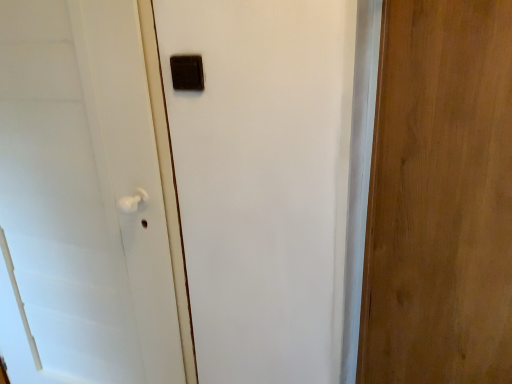
The height and width of the screenshot is (384, 512). Identify the location of matte brown switch at upper center. (187, 72).

From the image's perspective, between white matte door handle at left, the first door viewed from the left, and wooden door at right, the 2th door when ordered from left to right, which one is located above?

From the image's view, wooden door at right, the 2th door when ordered from left to right, is above.

Which of these two, white matte door handle at left, the first door viewed from the left, or wooden door at right, which is the first door in right-to-left order, stands taller?

white matte door handle at left, the first door viewed from the left, is taller.

Is white matte door handle at left, the second door in the right-to-left sequence, facing towards wooden door at right, the 2th door when ordered from left to right?

No, white matte door handle at left, the second door in the right-to-left sequence, is not aimed at wooden door at right, the 2th door when ordered from left to right.

Between point (414, 18) and point (200, 57), which one is positioned in front?

Point (200, 57)

Is the position of wooden door at right, the 2th door when ordered from left to right, more distant than that of matte brown switch at upper center?

That is False.

Is wooden door at right, the 2th door when ordered from left to right, positioned far away from matte brown switch at upper center?

No.

From the picture: Could matte brown switch at upper center be considered to be inside wooden door at right, which is the first door in right-to-left order?

No, matte brown switch at upper center is not a part of wooden door at right, which is the first door in right-to-left order.

Is matte brown switch at upper center positioned before white matte door handle at left, the second door in the right-to-left sequence?

No, the depth of matte brown switch at upper center is greater than that of white matte door handle at left, the second door in the right-to-left sequence.

Locate an element on the screen. The width and height of the screenshot is (512, 384). door on the left of the matte brown switch at upper center is located at coordinates (81, 200).

Consider the image. Is matte brown switch at upper center in contact with white matte door handle at left, the second door in the right-to-left sequence?

matte brown switch at upper center is not next to white matte door handle at left, the second door in the right-to-left sequence, and they're not touching.

Which of these two, matte brown switch at upper center or white matte door handle at left, the first door viewed from the left, stands shorter?

matte brown switch at upper center.

Is white matte door handle at left, the first door viewed from the left, located within wooden door at right, which is the first door in right-to-left order?

Definitely not — white matte door handle at left, the first door viewed from the left, is not inside wooden door at right, which is the first door in right-to-left order.

Is wooden door at right, which is the first door in right-to-left order, to the right of white matte door handle at left, the second door in the right-to-left sequence, from the viewer's perspective?

Yes.

From the image's perspective, which is below, wooden door at right, which is the first door in right-to-left order, or white matte door handle at left, the first door viewed from the left?

white matte door handle at left, the first door viewed from the left, appears lower in the image.

What's the angular difference between wooden door at right, the 2th door when ordered from left to right, and white matte door handle at left, the second door in the right-to-left sequence,'s facing directions?

1.63 degrees separate the facing orientations of wooden door at right, the 2th door when ordered from left to right, and white matte door handle at left, the second door in the right-to-left sequence.

From a real-world perspective, is white matte door handle at left, the second door in the right-to-left sequence, physically above matte brown switch at upper center?

No, from a real-world perspective, white matte door handle at left, the second door in the right-to-left sequence, is not over matte brown switch at upper center

Considering their positions, is white matte door handle at left, the second door in the right-to-left sequence, located in front of or behind matte brown switch at upper center?

Clearly, white matte door handle at left, the second door in the right-to-left sequence, is in front of matte brown switch at upper center.

What are the coordinates of `door that is the 2nd object located below the matte brown switch at upper center (from the image's perspective)` in the screenshot? It's located at (81, 200).

Is white matte door handle at left, the second door in the right-to-left sequence, positioned with its back to matte brown switch at upper center?

white matte door handle at left, the second door in the right-to-left sequence, does not have its back to matte brown switch at upper center.

Is matte brown switch at upper center positioned far away from wooden door at right, which is the first door in right-to-left order?

No.

Considering the relative sizes of matte brown switch at upper center and wooden door at right, the 2th door when ordered from left to right, in the image provided, is matte brown switch at upper center shorter than wooden door at right, the 2th door when ordered from left to right,?

Correct, matte brown switch at upper center is not as tall as wooden door at right, the 2th door when ordered from left to right.

Between point (183, 74) and point (457, 3), which one is positioned in front?

Point (183, 74)

You are a GUI agent. You are given a task and a screenshot of the screen. Output one action in this format:
    pyautogui.click(x=<x>, y=<y>)
    Task: Click on the door lying in front of the white matte door handle at left, the second door in the right-to-left sequence
    Image resolution: width=512 pixels, height=384 pixels.
    Given the screenshot: What is the action you would take?
    pyautogui.click(x=440, y=197)

Where is `door that is the 1st one below the matte brown switch at upper center (from a real-world perspective)`? door that is the 1st one below the matte brown switch at upper center (from a real-world perspective) is located at coordinates (440, 197).

Based on their spatial positions, is white matte door handle at left, the second door in the right-to-left sequence, or matte brown switch at upper center further from wooden door at right, which is the first door in right-to-left order?

Among the two, white matte door handle at left, the second door in the right-to-left sequence, is located further to wooden door at right, which is the first door in right-to-left order.

Considering their positions, is white matte door handle at left, the second door in the right-to-left sequence, positioned further to matte brown switch at upper center than wooden door at right, which is the first door in right-to-left order?

Based on the image, wooden door at right, which is the first door in right-to-left order, appears to be further to matte brown switch at upper center.

Which object lies further to the anchor point matte brown switch at upper center, wooden door at right, which is the first door in right-to-left order, or white matte door handle at left, the first door viewed from the left?

wooden door at right, which is the first door in right-to-left order, is further to matte brown switch at upper center.

Estimate the real-world distances between objects in this image. Which object is closer to white matte door handle at left, the second door in the right-to-left sequence, matte brown switch at upper center or wooden door at right, the 2th door when ordered from left to right?

matte brown switch at upper center is positioned closer to the anchor white matte door handle at left, the second door in the right-to-left sequence.

Considering their positions, is matte brown switch at upper center positioned further to wooden door at right, which is the first door in right-to-left order, than white matte door handle at left, the first door viewed from the left?

white matte door handle at left, the first door viewed from the left.

When comparing their distances from white matte door handle at left, the second door in the right-to-left sequence, does wooden door at right, which is the first door in right-to-left order, or matte brown switch at upper center seem closer?

Among the two, matte brown switch at upper center is located nearer to white matte door handle at left, the second door in the right-to-left sequence.

Locate an element on the screen. The width and height of the screenshot is (512, 384). light switch between white matte door handle at left, the first door viewed from the left, and wooden door at right, the 2th door when ordered from left to right, in the horizontal direction is located at coordinates (187, 72).